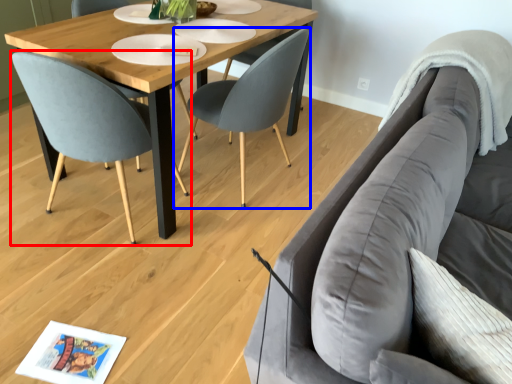
Question: Among these objects, which one is farthest to the camera, chair (highlighted by a red box) or chair (highlighted by a blue box)?

Choices:
 (A) chair
 (B) chair

Answer: (B)